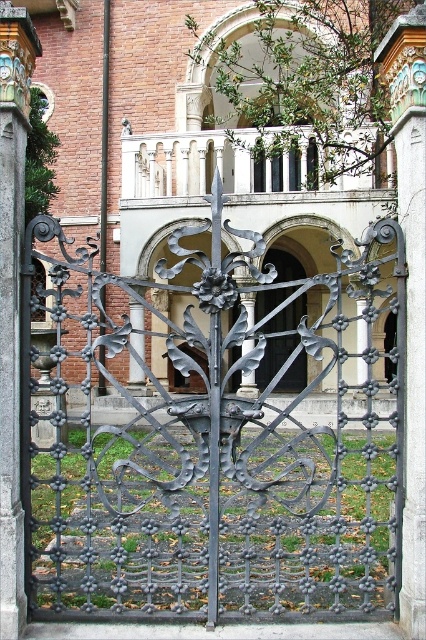
In the scene shown: Is gray stone pillar at right thinner than black wrought iron door at center?

Indeed, gray stone pillar at right has a lesser width compared to black wrought iron door at center.

Locate an element on the screen. gray stone pillar at right is located at coordinates (412, 360).

At what (x,y) coordinates should I click in order to perform the action: click on gray stone pillar at right. Please return your answer as a coordinate pair (x, y). Image resolution: width=426 pixels, height=640 pixels. Looking at the image, I should click on (x=412, y=360).

Is point (5, 196) in front of point (397, 177)?

Yes, point (5, 196) is in front of point (397, 177).

Consider the image. Is carved stone pillar at center shorter than gray stone pillar at right?

In fact, carved stone pillar at center may be taller than gray stone pillar at right.

Image resolution: width=426 pixels, height=640 pixels. Describe the element at coordinates (11, 298) in the screenshot. I see `carved stone pillar at center` at that location.

The width and height of the screenshot is (426, 640). Identify the location of carved stone pillar at center. (11, 298).

Is black wrought iron gate at center further to the viewer compared to black wrought iron door at center?

No, it is in front of black wrought iron door at center.

Is black wrought iron gate at center bigger than black wrought iron door at center?

Yes, black wrought iron gate at center is bigger than black wrought iron door at center.

At what (x,y) coordinates should I click in order to perform the action: click on black wrought iron gate at center. Please return your answer as a coordinate pair (x, y). Looking at the image, I should click on (210, 445).